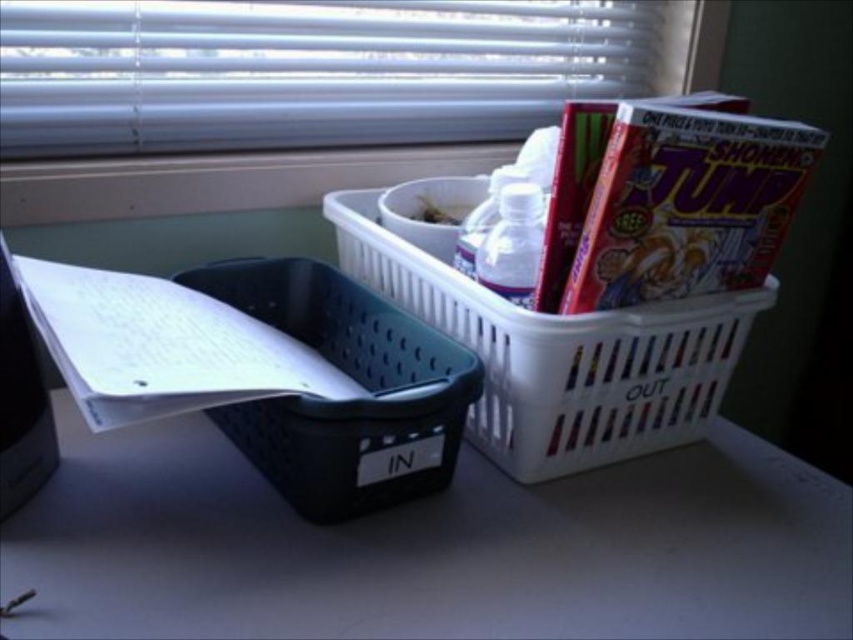
What do you see at coordinates (346, 401) in the screenshot?
I see `black plastic basket at left` at bounding box center [346, 401].

Does black plastic basket at left have a smaller size compared to white paper at left?

No, black plastic basket at left is not smaller than white paper at left.

Locate an element on the screen. black plastic basket at left is located at coordinates (346, 401).

Can you confirm if white plastic blinds at upper center is taller than white plastic basket at upper right?

In fact, white plastic blinds at upper center may be shorter than white plastic basket at upper right.

Where is `white plastic blinds at upper center`? The height and width of the screenshot is (640, 853). white plastic blinds at upper center is located at coordinates (309, 70).

Find the location of a particular element. This screenshot has height=640, width=853. white plastic blinds at upper center is located at coordinates (309, 70).

Is white plastic basket at upper right smaller than black plastic basket at left?

Actually, white plastic basket at upper right might be larger than black plastic basket at left.

Can you confirm if white plastic basket at upper right is positioned to the left of black plastic basket at left?

Incorrect, white plastic basket at upper right is not on the left side of black plastic basket at left.

Does point (685, 307) lie in front of point (312, 269)?

Yes, point (685, 307) is in front of point (312, 269).

Locate an element on the screen. white plastic basket at upper right is located at coordinates point(560,355).